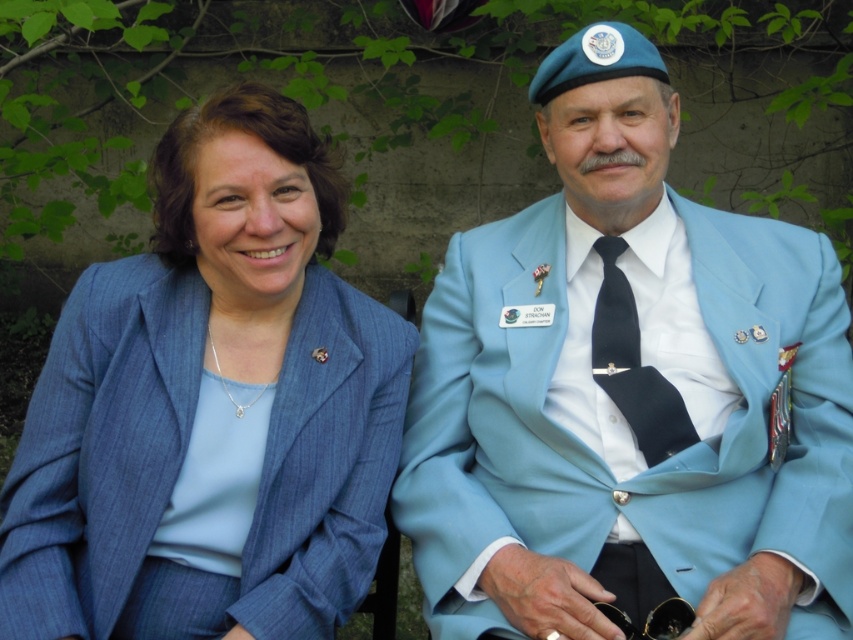
Which is above, light blue suit at center or matte blue suit at left?

light blue suit at center is above.

Between light blue suit at center and matte blue suit at left, which one appears on the right side from the viewer's perspective?

Positioned to the right is light blue suit at center.

Is point (553, 508) positioned behind point (242, 376)?

No, (553, 508) is in front of (242, 376).

Find the location of a particular element. light blue suit at center is located at coordinates pyautogui.click(x=630, y=392).